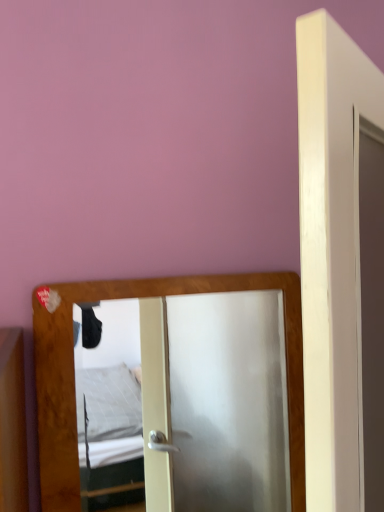
Question: Is wooden mirror at center to the left of white matte door at center from the viewer's perspective?

Choices:
 (A) yes
 (B) no

Answer: (A)

Question: Does wooden mirror at center appear on the right side of white matte door at center?

Choices:
 (A) no
 (B) yes

Answer: (A)

Question: From the image's perspective, would you say wooden mirror at center is positioned over white matte door at center?

Choices:
 (A) no
 (B) yes

Answer: (A)

Question: Is wooden mirror at center not near white matte door at center?

Choices:
 (A) no
 (B) yes

Answer: (B)

Question: Is wooden mirror at center not within white matte door at center?

Choices:
 (A) yes
 (B) no

Answer: (A)

Question: Does wooden mirror at center come in front of white matte door at center?

Choices:
 (A) yes
 (B) no

Answer: (B)

Question: Would you say white matte door at center is outside wooden mirror at center?

Choices:
 (A) yes
 (B) no

Answer: (A)

Question: Can you confirm if white matte door at center is positioned to the right of wooden mirror at center?

Choices:
 (A) no
 (B) yes

Answer: (B)

Question: From the image's perspective, is white matte door at center located above wooden mirror at center?

Choices:
 (A) yes
 (B) no

Answer: (A)

Question: Can you see white matte door at center touching wooden mirror at center?

Choices:
 (A) no
 (B) yes

Answer: (A)

Question: Considering the relative sizes of white matte door at center and wooden mirror at center in the image provided, is white matte door at center smaller than wooden mirror at center?

Choices:
 (A) no
 (B) yes

Answer: (A)

Question: Considering the relative positions of white matte door at center and wooden mirror at center in the image provided, is white matte door at center in front of wooden mirror at center?

Choices:
 (A) yes
 (B) no

Answer: (A)

Question: Based on their positions, is white matte door at center located to the left or right of wooden mirror at center?

Choices:
 (A) left
 (B) right

Answer: (B)